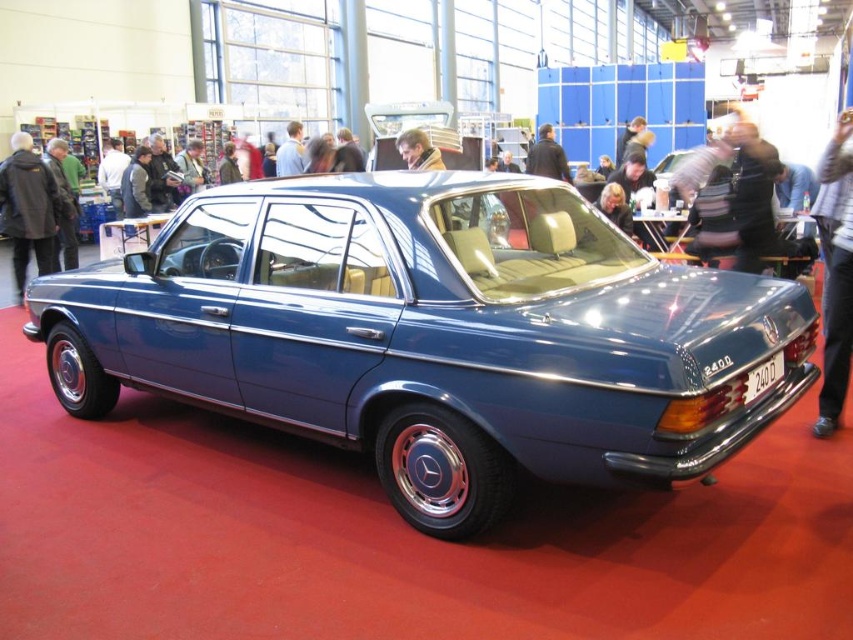
Question: Can you confirm if metallic blue sedan at center is thinner than dark blue leather jacket at upper center?

Choices:
 (A) no
 (B) yes

Answer: (A)

Question: Is metallic blue sedan at center to the right of dark blue leather jacket at upper center from the viewer's perspective?

Choices:
 (A) no
 (B) yes

Answer: (A)

Question: Among these objects, which one is farthest from the camera?

Choices:
 (A) metallic blue sedan at center
 (B) dark blue leather jacket at upper center

Answer: (B)

Question: Can you confirm if metallic blue sedan at center is bigger than dark blue leather jacket at upper center?

Choices:
 (A) no
 (B) yes

Answer: (B)